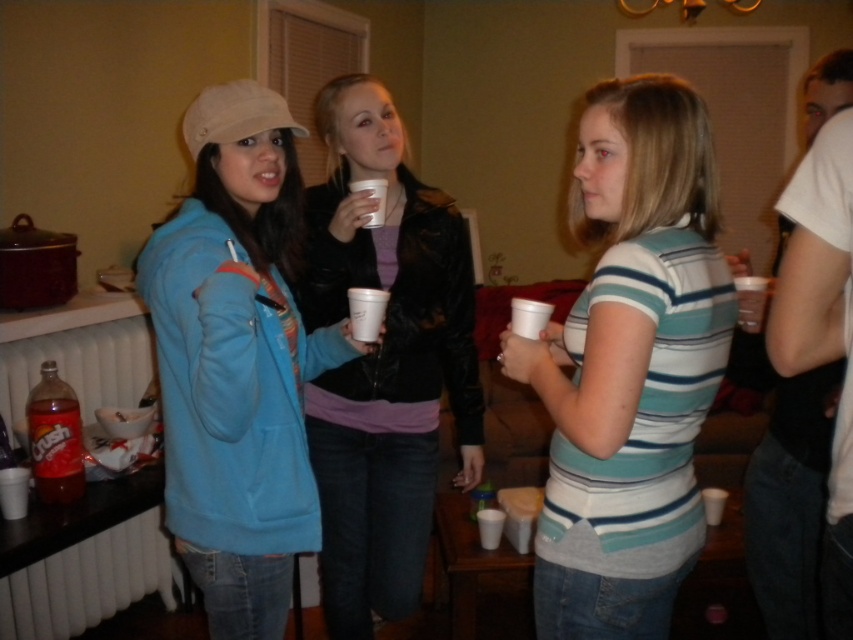
You are organizing a charity event and need to decide which item to donate first. The striped cotton shirt at center and the translucent plastic bottle of crush soda at lower left are both available. Based on their sizes, which item should you choose to donate first if you prioritize larger items?

The striped cotton shirt at center is bigger than the translucent plastic bottle of crush soda at lower left, so you should donate the striped cotton shirt at center first.